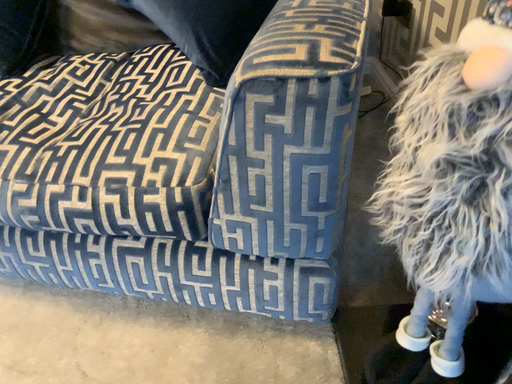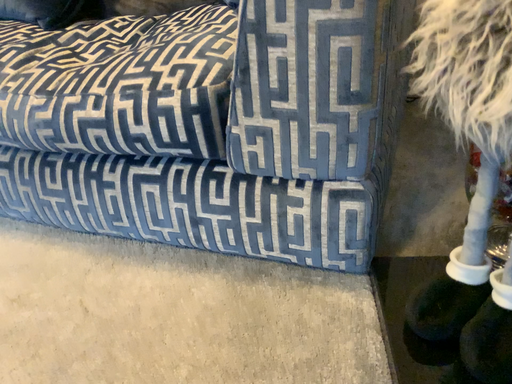
Question: How did the camera likely rotate when shooting the video?

Choices:
 (A) rotated left
 (B) rotated right

Answer: (A)